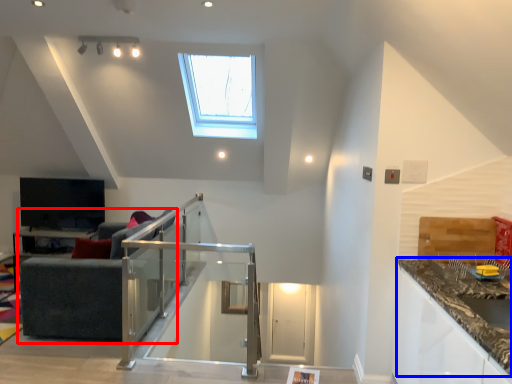
Question: Which point is closer to the camera, studio couch (highlighted by a red box) or countertop (highlighted by a blue box)?

Choices:
 (A) studio couch
 (B) countertop

Answer: (B)